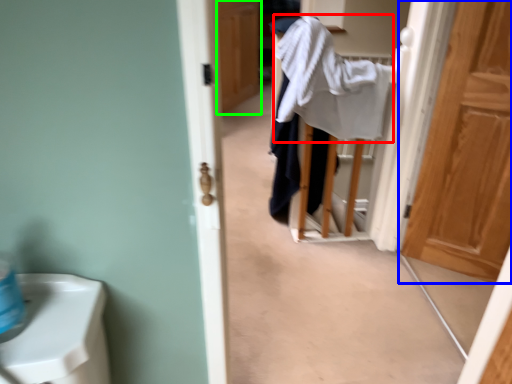
Question: Which object is the farthest from bath towel (highlighted by a red box)? Choose among these: door (highlighted by a blue box) or door (highlighted by a green box).

Choices:
 (A) door
 (B) door

Answer: (B)